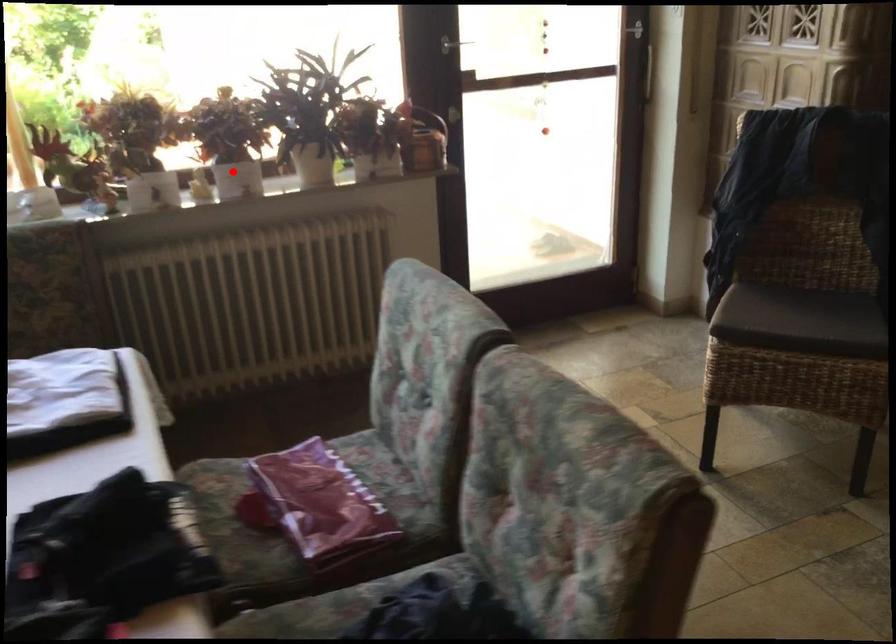
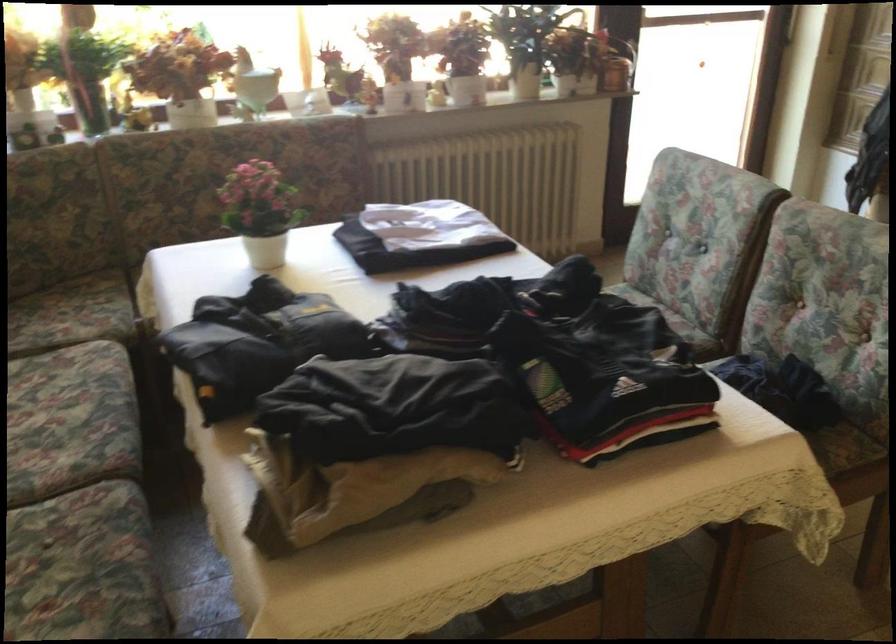
Question: I am providing you with two images of the same scene from different viewpoints. Image1 has a red point marked. In image2, the corresponding 3D location appears at what relative position? Reply with the corresponding letter.

Choices:
 (A) Closer
 (B) Farther

Answer: (B)